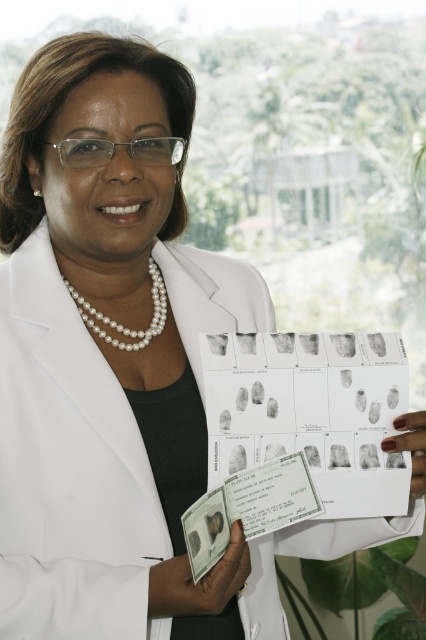
Can you confirm if white paper at center is thinner than nail polish painted fingernails at center?

No.

Is white paper at center to the right of nail polish painted fingernails at center from the viewer's perspective?

No, white paper at center is not to the right of nail polish painted fingernails at center.

Is point (157, 572) farther from camera compared to point (417, 470)?

No.

Locate an element on the screen. Image resolution: width=426 pixels, height=640 pixels. white paper at center is located at coordinates (198, 580).

Who is positioned more to the left, pearl necklace at center or nail polish painted fingernails at center?

From the viewer's perspective, pearl necklace at center appears more on the left side.

Which is in front, point (129, 332) or point (416, 497)?

Point (416, 497) is in front.

Find the location of a particular element. pearl necklace at center is located at coordinates tap(121, 324).

Is point (187, 616) positioned before point (154, 266)?

Yes, point (187, 616) is closer to viewer.

Who is higher up, white paper at center or pearl necklace at center?

pearl necklace at center is above.

Is point (203, 602) closer to viewer compared to point (161, 310)?

Yes.

Locate an element on the screen. The height and width of the screenshot is (640, 426). white paper at center is located at coordinates (198, 580).